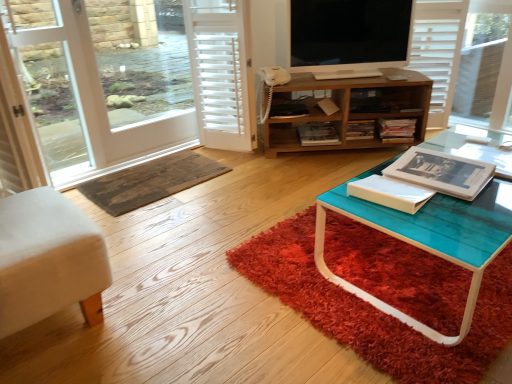
Image resolution: width=512 pixels, height=384 pixels. What are the coordinates of `vacant space in black glossy tv at upper center (from a real-world perspective)` in the screenshot? It's located at (336, 70).